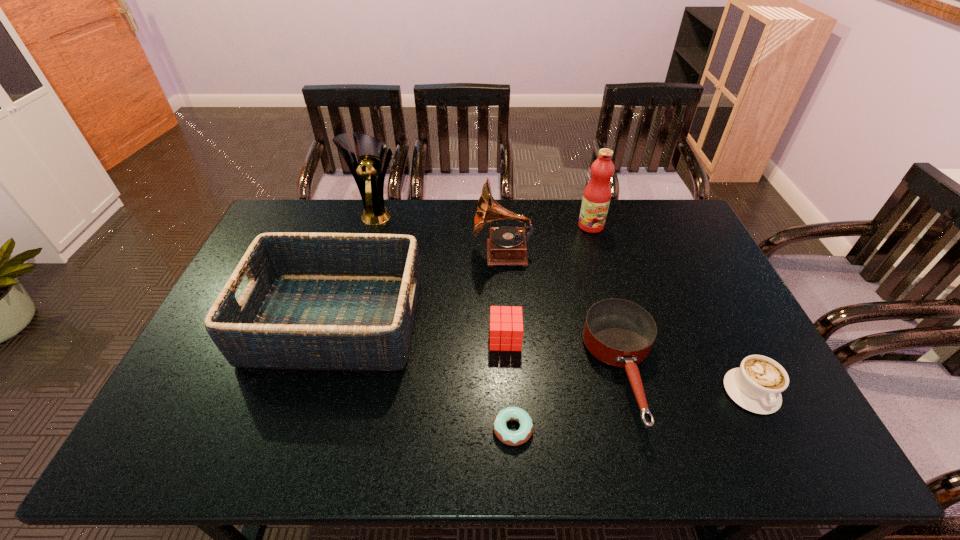
Identify the location of award. The width and height of the screenshot is (960, 540). (367, 172).

I want to click on fruit juice, so (596, 198).

You are a GUI agent. You are given a task and a screenshot of the screen. Output one action in this format:
    pyautogui.click(x=<x>, y=<y>)
    Task: Click on the sixth nearest object
    The height and width of the screenshot is (540, 960).
    Given the screenshot: What is the action you would take?
    pyautogui.click(x=507, y=245)

The image size is (960, 540). In order to click on basket in this screenshot , I will do `click(314, 301)`.

Identify the location of cube. Image resolution: width=960 pixels, height=540 pixels. (506, 328).

In order to click on cappuccino in this screenshot , I will do `click(756, 386)`.

Locate an element on the screen. The height and width of the screenshot is (540, 960). pan is located at coordinates (620, 333).

At what (x,y) coordinates should I click in order to perform the action: click on doughnut. Please return your answer as a coordinate pair (x, y). Looking at the image, I should click on (513, 438).

In order to click on free location located at the front of the award, where the globe is visible in this screenshot , I will do `click(352, 299)`.

Where is `blank area located on the front label of the fruit juice`? Image resolution: width=960 pixels, height=540 pixels. blank area located on the front label of the fruit juice is located at coordinates (602, 262).